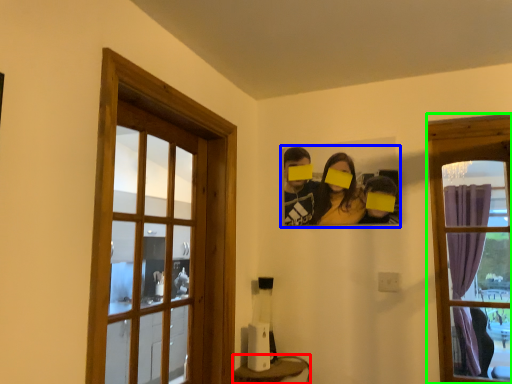
Question: Based on their relative distances, which object is nearer to furniture (highlighted by a red box)? Choose from couple (highlighted by a blue box) and window (highlighted by a green box).

Choices:
 (A) couple
 (B) window

Answer: (A)